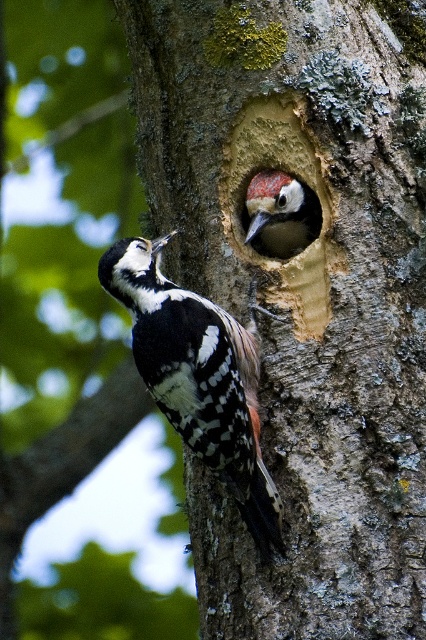
You are a birdwatcher standing 10 feet away from the tree trunk. You see the white speckled woodpecker at left and the speckled brown woodpecker at center. Can you clearly see both birds at the same time without moving your head?

The white speckled woodpecker at left is 8.50 inches away from the speckled brown woodpecker at center. Since the birds are only 8.50 inches apart on the tree trunk, and you are 10 feet away, their proximity means they would likely be within your field of view without needing to move your head.

You are a birdwatcher observing the two woodpeckers in the scene. Which woodpecker is positioned closer to you, the white speckled woodpecker at left or the speckled brown woodpecker at center?

The white speckled woodpecker at left is closer to the viewer than the speckled brown woodpecker at center.

You are a birdwatcher observing two woodpeckers near a tree trunk. You see the white speckled woodpecker at left and the speckled brown woodpecker at center. Which woodpecker is taller?

The white speckled woodpecker at left is taller than the speckled brown woodpecker at center.